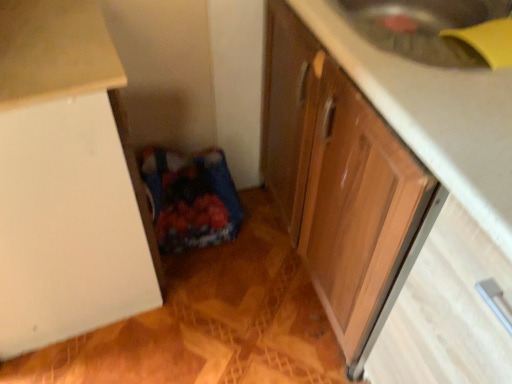
Image resolution: width=512 pixels, height=384 pixels. What are the coordinates of `white matte cabinet at left, the second cabinetry in the right-to-left sequence` in the screenshot? It's located at (64, 180).

Is wooden drawer at lower right positioned with its back to wooden cabinet at lower right, acting as the 1th cabinetry starting from the right?

Absolutely, wooden drawer at lower right is directed away from wooden cabinet at lower right, acting as the 1th cabinetry starting from the right.

Which is in front, point (464, 351) or point (480, 212)?

The point (480, 212) is closer to the camera.

Between wooden drawer at lower right and wooden cabinet at lower right, acting as the 2th cabinetry starting from the left, which one is positioned in front?

wooden cabinet at lower right, acting as the 2th cabinetry starting from the left, is in front.

Is wooden drawer at lower right situated inside wooden cabinet at lower right, acting as the 1th cabinetry starting from the right, or outside?

wooden drawer at lower right is located inside wooden cabinet at lower right, acting as the 1th cabinetry starting from the right.

This screenshot has width=512, height=384. I want to click on cabinetry in front of the wooden drawer at lower right, so click(x=374, y=159).

From the picture: Does wooden cabinet at lower right, acting as the 1th cabinetry starting from the right, lie behind wooden drawer at lower right?

No, the depth of wooden cabinet at lower right, acting as the 1th cabinetry starting from the right, is less than that of wooden drawer at lower right.

Is wooden cabinet at lower right, acting as the 2th cabinetry starting from the left, aimed at wooden drawer at lower right?

No, wooden cabinet at lower right, acting as the 2th cabinetry starting from the left, is not aimed at wooden drawer at lower right.

Does point (286, 60) lie in front of point (368, 375)?

No.

Is point (42, 304) closer to camera compared to point (338, 127)?

No, (42, 304) is behind (338, 127).

Is wooden cabinet at lower right, acting as the 1th cabinetry starting from the right, located within white matte cabinet at left, the second cabinetry in the right-to-left sequence?

Definitely not — wooden cabinet at lower right, acting as the 1th cabinetry starting from the right, is not inside white matte cabinet at left, the second cabinetry in the right-to-left sequence.

Is white matte cabinet at left, which is the 1th cabinetry from left to right, bigger than wooden cabinet at lower right, acting as the 2th cabinetry starting from the left?

No.

Could you measure the distance between white matte cabinet at left, which is the 1th cabinetry from left to right, and wooden cabinet at lower right, acting as the 1th cabinetry starting from the right?

white matte cabinet at left, which is the 1th cabinetry from left to right, and wooden cabinet at lower right, acting as the 1th cabinetry starting from the right, are 22.41 inches apart.

Looking at this image, is white matte cabinet at left, which is the 1th cabinetry from left to right, with wooden drawer at lower right?

No, white matte cabinet at left, which is the 1th cabinetry from left to right, is not beside wooden drawer at lower right.

This screenshot has height=384, width=512. I want to click on cabinetry that is the 1st one when counting upward from the wooden drawer at lower right (from the image's perspective), so click(x=64, y=180).

From the image's perspective, is white matte cabinet at left, which is the 1th cabinetry from left to right, on wooden drawer at lower right?

Indeed, from the image's perspective, white matte cabinet at left, which is the 1th cabinetry from left to right, is shown above wooden drawer at lower right.

From a real-world perspective, does white matte cabinet at left, which is the 1th cabinetry from left to right, stand above wooden drawer at lower right?

Correct, in the physical world, white matte cabinet at left, which is the 1th cabinetry from left to right, is higher than wooden drawer at lower right.

Considering the sizes of objects wooden drawer at lower right and white matte cabinet at left, the second cabinetry in the right-to-left sequence, in the image provided, who is wider, wooden drawer at lower right or white matte cabinet at left, the second cabinetry in the right-to-left sequence,?

Wider between the two is wooden drawer at lower right.

From the picture: Based on their positions, is wooden drawer at lower right located to the left or right of white matte cabinet at left, which is the 1th cabinetry from left to right?

wooden drawer at lower right is to the right of white matte cabinet at left, which is the 1th cabinetry from left to right.

In the image, is wooden drawer at lower right positioned in front of or behind white matte cabinet at left, which is the 1th cabinetry from left to right?

Clearly, wooden drawer at lower right is in front of white matte cabinet at left, which is the 1th cabinetry from left to right.

Does wooden drawer at lower right contain white matte cabinet at left, the second cabinetry in the right-to-left sequence?

No, wooden drawer at lower right does not contain white matte cabinet at left, the second cabinetry in the right-to-left sequence.

Do you think wooden cabinet at lower right, acting as the 2th cabinetry starting from the left, is within white matte cabinet at left, which is the 1th cabinetry from left to right, or outside of it?

wooden cabinet at lower right, acting as the 2th cabinetry starting from the left, is spatially situated outside white matte cabinet at left, which is the 1th cabinetry from left to right.

Could you tell me if wooden cabinet at lower right, acting as the 1th cabinetry starting from the right, is turned towards white matte cabinet at left, which is the 1th cabinetry from left to right?

Yes, wooden cabinet at lower right, acting as the 1th cabinetry starting from the right, is aimed at white matte cabinet at left, which is the 1th cabinetry from left to right.

Does wooden cabinet at lower right, acting as the 2th cabinetry starting from the left, touch white matte cabinet at left, which is the 1th cabinetry from left to right?

wooden cabinet at lower right, acting as the 2th cabinetry starting from the left, is not next to white matte cabinet at left, which is the 1th cabinetry from left to right, and they're not touching.

Is wooden cabinet at lower right, acting as the 2th cabinetry starting from the left, taller than white matte cabinet at left, which is the 1th cabinetry from left to right?

No, wooden cabinet at lower right, acting as the 2th cabinetry starting from the left, is not taller than white matte cabinet at left, which is the 1th cabinetry from left to right.

Where is `drawer below the wooden cabinet at lower right, acting as the 1th cabinetry starting from the right (from a real-world perspective)`? drawer below the wooden cabinet at lower right, acting as the 1th cabinetry starting from the right (from a real-world perspective) is located at coordinates (447, 311).

You are a GUI agent. You are given a task and a screenshot of the screen. Output one action in this format:
    pyautogui.click(x=<x>, y=<y>)
    Task: Click on the 2nd cabinetry located above the wooden drawer at lower right (from a real-world perspective)
    This screenshot has width=512, height=384.
    Given the screenshot: What is the action you would take?
    pyautogui.click(x=374, y=159)

Based on their spatial positions, is white matte cabinet at left, the second cabinetry in the right-to-left sequence, or wooden cabinet at lower right, acting as the 2th cabinetry starting from the left, closer to wooden drawer at lower right?

wooden cabinet at lower right, acting as the 2th cabinetry starting from the left, is closer to wooden drawer at lower right.

Considering their positions, is wooden cabinet at lower right, acting as the 1th cabinetry starting from the right, positioned further to wooden drawer at lower right than white matte cabinet at left, the second cabinetry in the right-to-left sequence?

white matte cabinet at left, the second cabinetry in the right-to-left sequence.

Based on the photo, based on their spatial positions, is wooden drawer at lower right or wooden cabinet at lower right, acting as the 2th cabinetry starting from the left, further from white matte cabinet at left, the second cabinetry in the right-to-left sequence?

The object further to white matte cabinet at left, the second cabinetry in the right-to-left sequence, is wooden drawer at lower right.

Looking at the image, which one is located further to wooden cabinet at lower right, acting as the 2th cabinetry starting from the left, wooden drawer at lower right or white matte cabinet at left, the second cabinetry in the right-to-left sequence?

The object further to wooden cabinet at lower right, acting as the 2th cabinetry starting from the left, is white matte cabinet at left, the second cabinetry in the right-to-left sequence.

When comparing their distances from white matte cabinet at left, the second cabinetry in the right-to-left sequence, does wooden cabinet at lower right, acting as the 1th cabinetry starting from the right, or wooden drawer at lower right seem closer?

Based on the image, wooden cabinet at lower right, acting as the 1th cabinetry starting from the right, appears to be nearer to white matte cabinet at left, the second cabinetry in the right-to-left sequence.

Looking at the image, which one is located closer to wooden cabinet at lower right, acting as the 2th cabinetry starting from the left, white matte cabinet at left, the second cabinetry in the right-to-left sequence, or wooden drawer at lower right?

Based on the image, wooden drawer at lower right appears to be nearer to wooden cabinet at lower right, acting as the 2th cabinetry starting from the left.

I want to click on cabinetry between white matte cabinet at left, the second cabinetry in the right-to-left sequence, and wooden drawer at lower right, so click(374, 159).